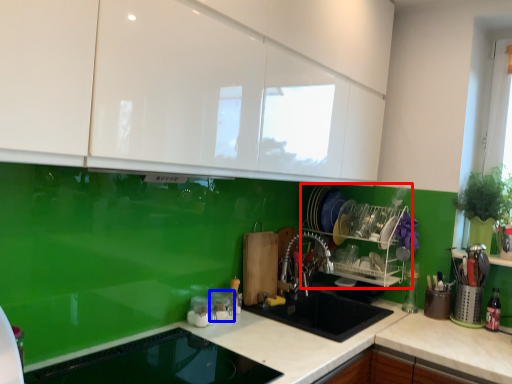
Question: Which of the following is the closest to the observer, appliance (highlighted by a red box) or appliance (highlighted by a blue box)?

Choices:
 (A) appliance
 (B) appliance

Answer: (B)